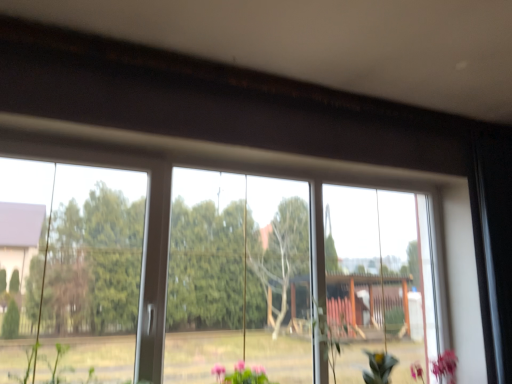
Find the location of a particular element. transparent glass window at center is located at coordinates (333, 182).

Describe the element at coordinates (333, 182) in the screenshot. I see `transparent glass window at center` at that location.

Image resolution: width=512 pixels, height=384 pixels. In order to click on transparent glass window at center in this screenshot , I will do `click(333, 182)`.